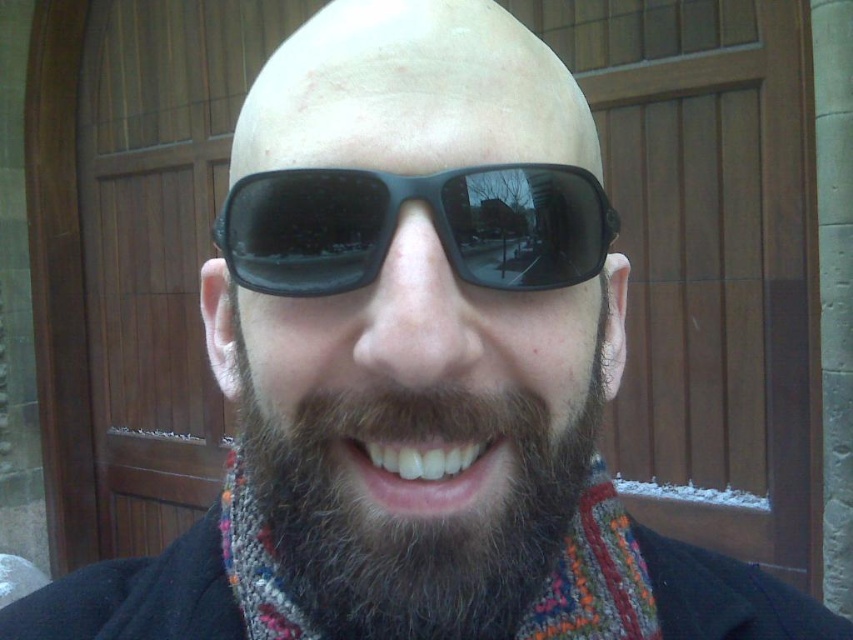
In the scene shown: Is dark brown fuzzy beard at center bigger than black plastic sunglasses at center?

Correct, dark brown fuzzy beard at center is larger in size than black plastic sunglasses at center.

Can you confirm if dark brown fuzzy beard at center is thinner than black plastic sunglasses at center?

No, dark brown fuzzy beard at center is not thinner than black plastic sunglasses at center.

Which is in front, point (561, 499) or point (558, 244)?

Point (558, 244) is in front.

This screenshot has width=853, height=640. In order to click on dark brown fuzzy beard at center in this screenshot , I will do `click(421, 524)`.